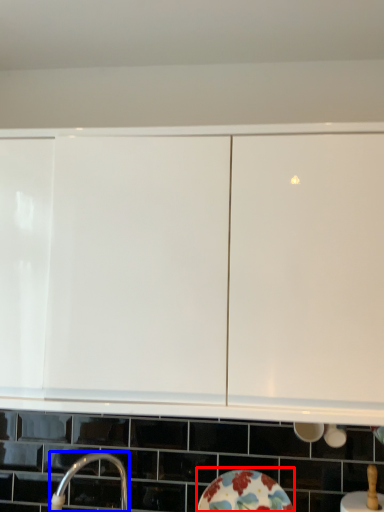
Question: Which of the following is the closest to the observer, plate (highlighted by a red box) or tap (highlighted by a blue box)?

Choices:
 (A) plate
 (B) tap

Answer: (B)